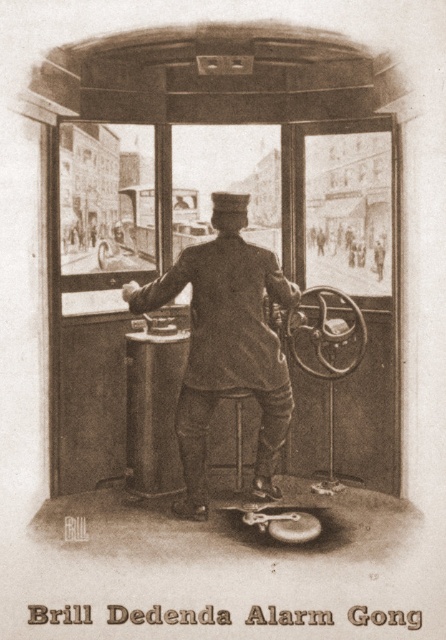
Consider the image. Who is positioned more to the right, uniformed man at center or wooden stool at center?

wooden stool at center is more to the right.

Can you confirm if uniformed man at center is positioned below wooden stool at center?

Actually, uniformed man at center is above wooden stool at center.

Which is in front, point (151, 296) or point (235, 467)?

Positioned in front is point (151, 296).

This screenshot has height=640, width=446. In order to click on uniformed man at center in this screenshot , I will do `click(226, 344)`.